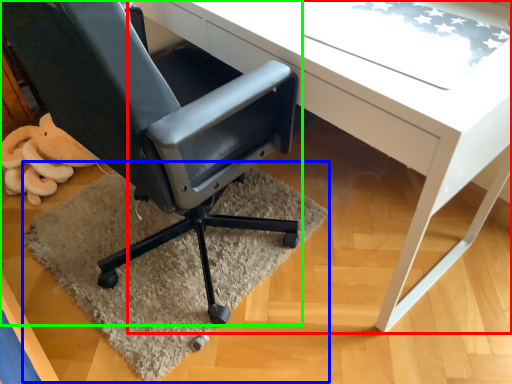
Question: Which object is the closest to the desk (highlighted by a red box)? Choose among these: mat (highlighted by a blue box) or chair (highlighted by a green box).

Choices:
 (A) mat
 (B) chair

Answer: (B)